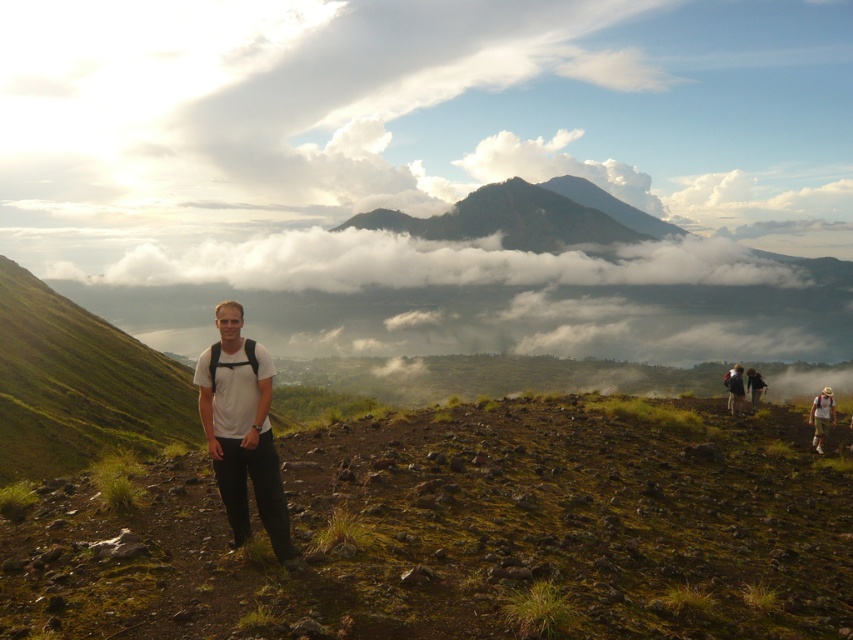
Question: Considering the relative positions of dark gray rocky mountain at center and camouflage fabric backpack at lower right in the image provided, where is dark gray rocky mountain at center located with respect to camouflage fabric backpack at lower right?

Choices:
 (A) left
 (B) right

Answer: (B)

Question: Is dark gray rocky mountain at center smaller than camouflage fabric backpack at lower right?

Choices:
 (A) no
 (B) yes

Answer: (A)

Question: Considering the real-world distances, which object is closest to the white matte t-shirt at center?

Choices:
 (A) dark brown backpack at right
 (B) dark gray rocky mountain at center

Answer: (A)

Question: Which object is farther from the camera taking this photo?

Choices:
 (A) white matte t-shirt at center
 (B) light brown backpack at lower right
 (C) dark brown backpack at right

Answer: (C)

Question: Which point is closer to the camera?

Choices:
 (A) (824, 433)
 (B) (740, 416)
 (C) (200, 397)
 (D) (755, 403)

Answer: (C)

Question: Does camouflage fabric backpack at lower right appear on the left side of dark brown backpack at right?

Choices:
 (A) no
 (B) yes

Answer: (B)